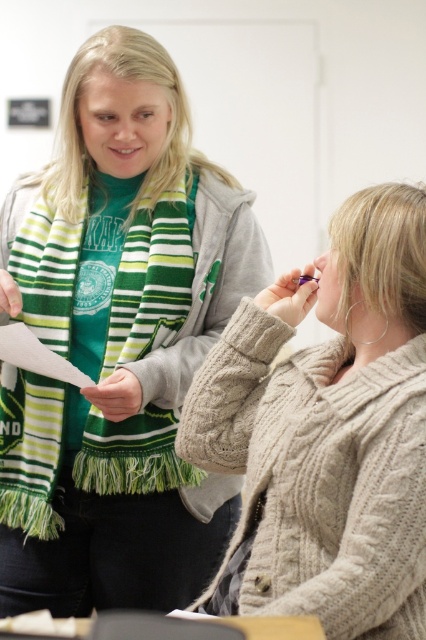
You are standing in the classroom and want to take a photo of the point at coordinates (0,442). The camera you have can focus on objects within 5 feet. Will the point be in focus?

The distance between the point at coordinates (0,442) and the camera is 5.20 feet, which is slightly beyond the camera focus range of 5 feet. Therefore, the point will not be in focus.